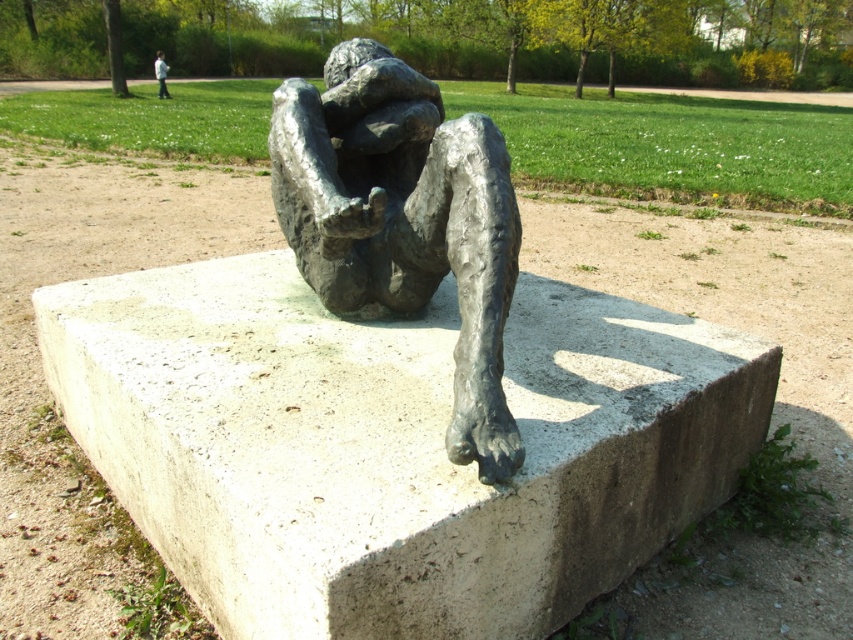
Consider the image. Can you confirm if bronze sculpture at center is positioned to the left of white cotton shirt at upper center?

Incorrect, bronze sculpture at center is not on the left side of white cotton shirt at upper center.

Locate an element on the screen. This screenshot has width=853, height=640. bronze sculpture at center is located at coordinates (404, 220).

Is smooth concrete base at center further to the viewer compared to white cotton shirt at upper center?

No, smooth concrete base at center is closer to the viewer.

Does smooth concrete base at center have a greater width compared to white cotton shirt at upper center?

Correct, the width of smooth concrete base at center exceeds that of white cotton shirt at upper center.

Who is more forward, (643, 332) or (155, 60)?

Point (643, 332) is in front.

You are a GUI agent. You are given a task and a screenshot of the screen. Output one action in this format:
    pyautogui.click(x=<x>, y=<y>)
    Task: Click on the smooth concrete base at center
    This screenshot has width=853, height=640.
    Given the screenshot: What is the action you would take?
    pyautogui.click(x=393, y=445)

Does smooth concrete base at center have a lesser width compared to bronze sculpture at center?

In fact, smooth concrete base at center might be wider than bronze sculpture at center.

Which is below, smooth concrete base at center or bronze sculpture at center?

smooth concrete base at center is below.

Who is more forward, (x=242, y=342) or (x=322, y=122)?

Point (x=242, y=342) is in front.

Image resolution: width=853 pixels, height=640 pixels. Find the location of `smooth concrete base at center`. smooth concrete base at center is located at coordinates (393, 445).